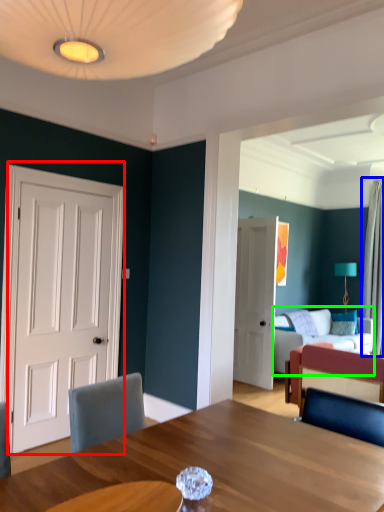
Question: Which is nearer to the door (highlighted by a red box)? curtain (highlighted by a blue box) or studio couch (highlighted by a green box).

Choices:
 (A) curtain
 (B) studio couch

Answer: (B)